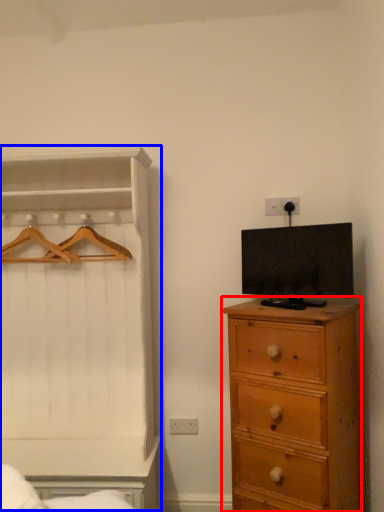
Question: Which of the following is the farthest to the observer, chest of drawers (highlighted by a red box) or dresser (highlighted by a blue box)?

Choices:
 (A) chest of drawers
 (B) dresser

Answer: (B)